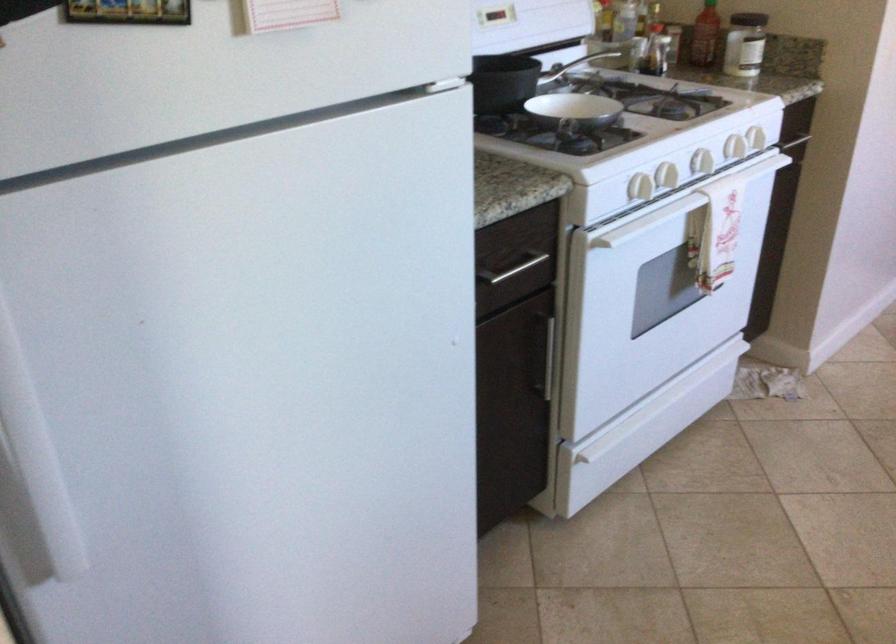
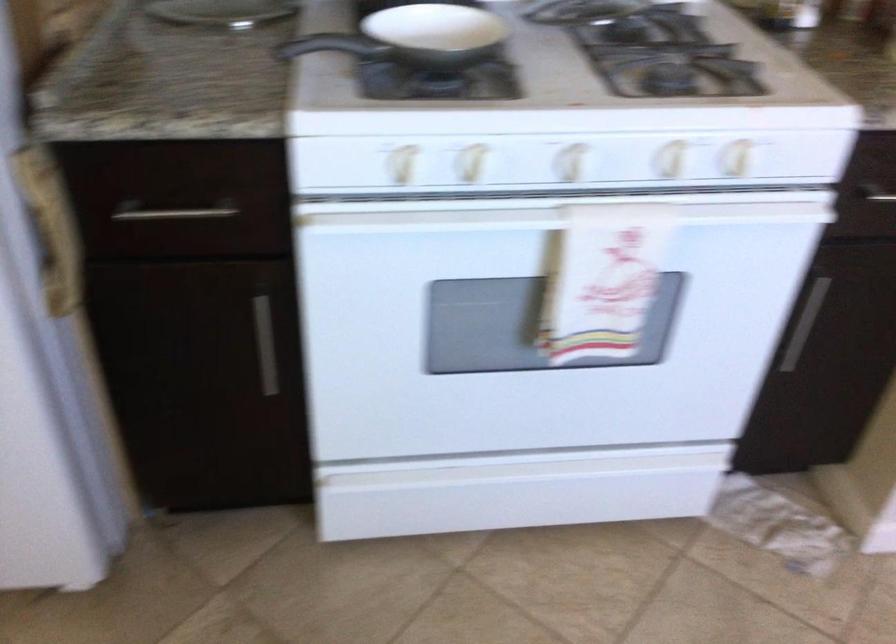
Where in the second image is the point corresponding to (x=755, y=100) from the first image?

(737, 158)